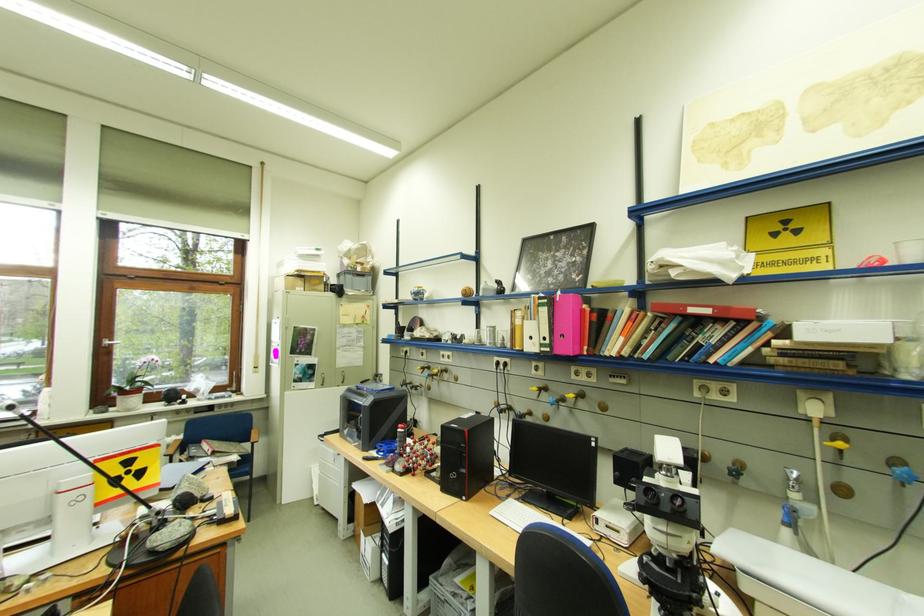
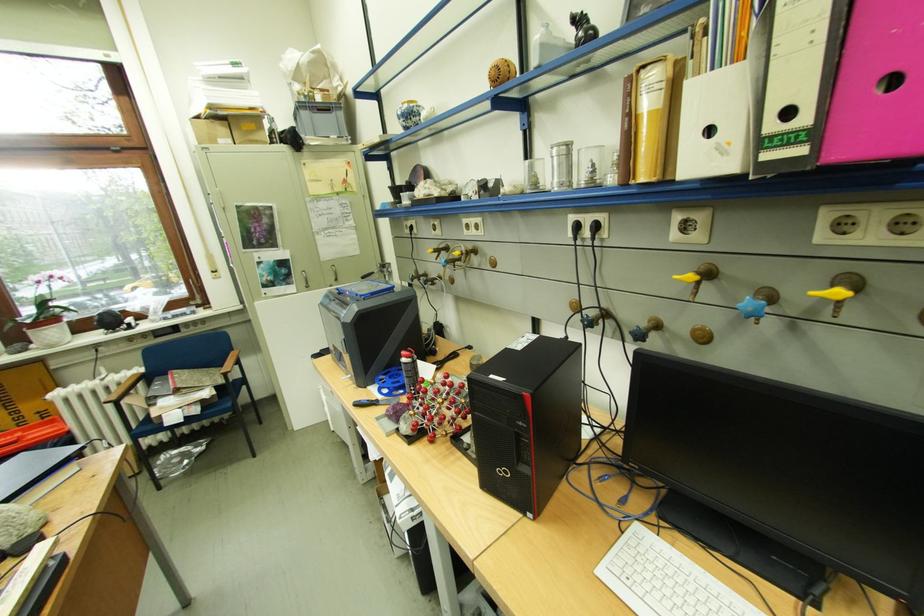
The point at (x=408, y=468) is marked in the first image. Where is the corresponding point in the second image?

(415, 429)